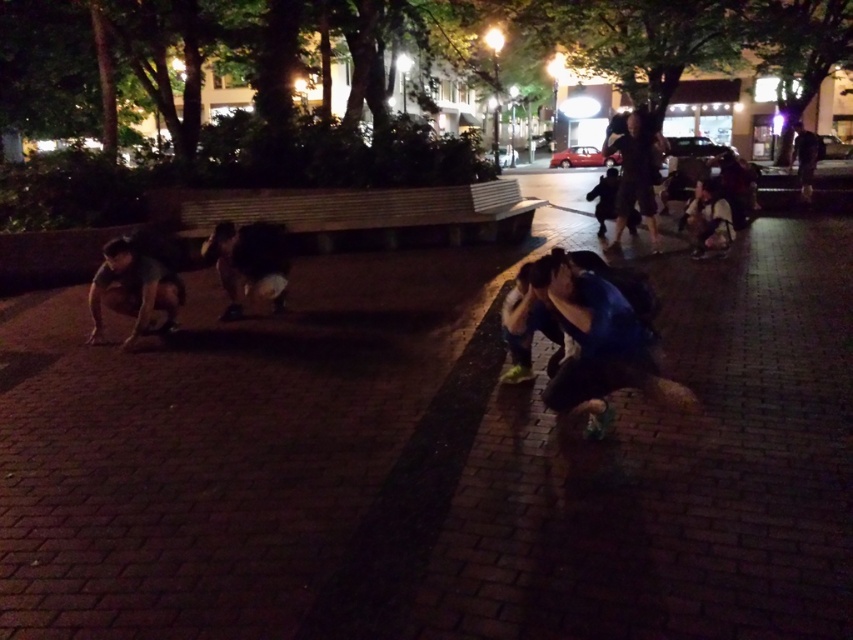
Question: Which object is positioned farthest from the dark blue fabric pants at center?

Choices:
 (A) blue fabric at lower right
 (B) dark gray fabric pants at right

Answer: (B)

Question: Which point is closer to the camera?

Choices:
 (A) dark brick pavement at center
 (B) dark blue jeans at upper right

Answer: (A)

Question: Is blue fabric at lower right above dark gray fabric pants at right?

Choices:
 (A) no
 (B) yes

Answer: (A)

Question: Considering the relative positions of blue fabric at lower right and dark gray fabric pants at right in the image provided, where is blue fabric at lower right located with respect to dark gray fabric pants at right?

Choices:
 (A) above
 (B) below

Answer: (B)

Question: Can you confirm if dark gray fabric pants at right is smaller than dark blue jeans at upper right?

Choices:
 (A) yes
 (B) no

Answer: (B)

Question: Based on their relative distances, which object is nearer to the dark blue jeans at upper right?

Choices:
 (A) white wood bench at center
 (B) dark gray fabric pants at right
 (C) dark brick pavement at center

Answer: (B)